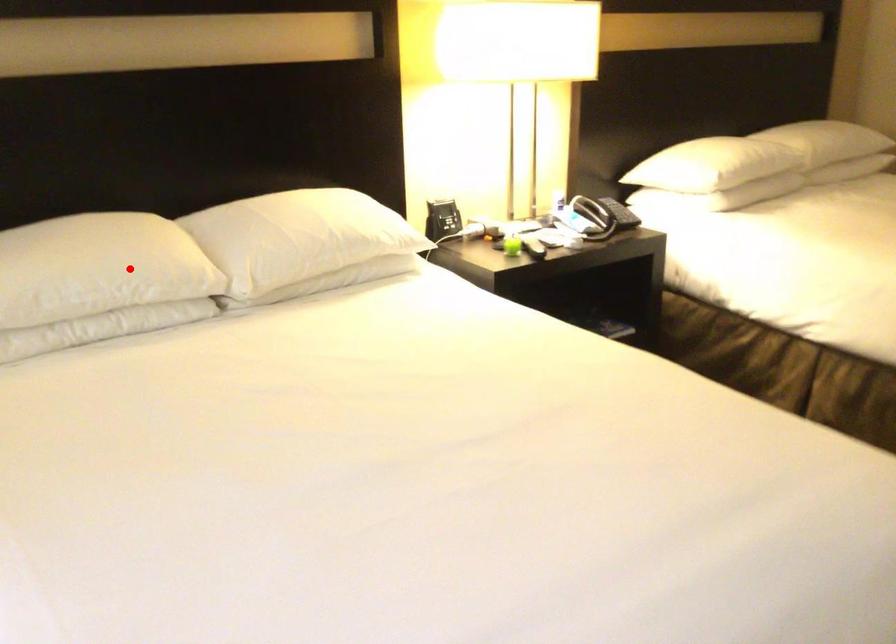
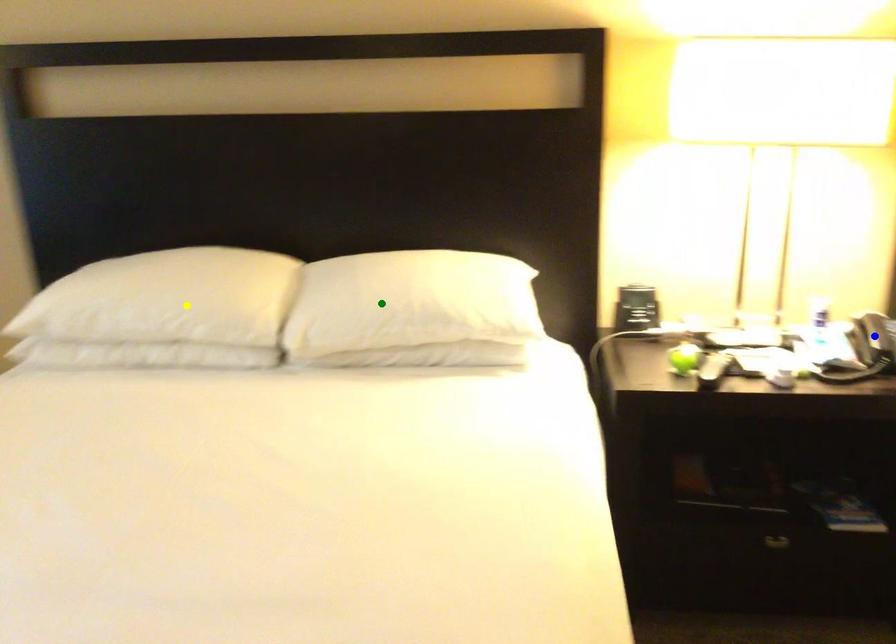
Question: I am providing you with two images of the same scene from different viewpoints. A red point is marked on the first image. You are given multiple points on the second image. Which point in image 2 is actually the same real-world point as the red point in image 1?

Choices:
 (A) blue point
 (B) green point
 (C) yellow point

Answer: (C)